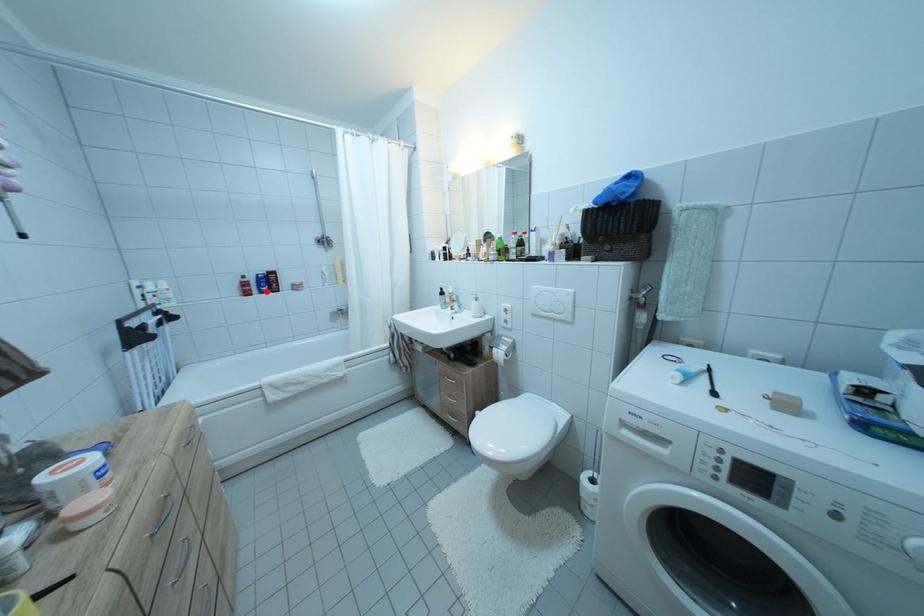
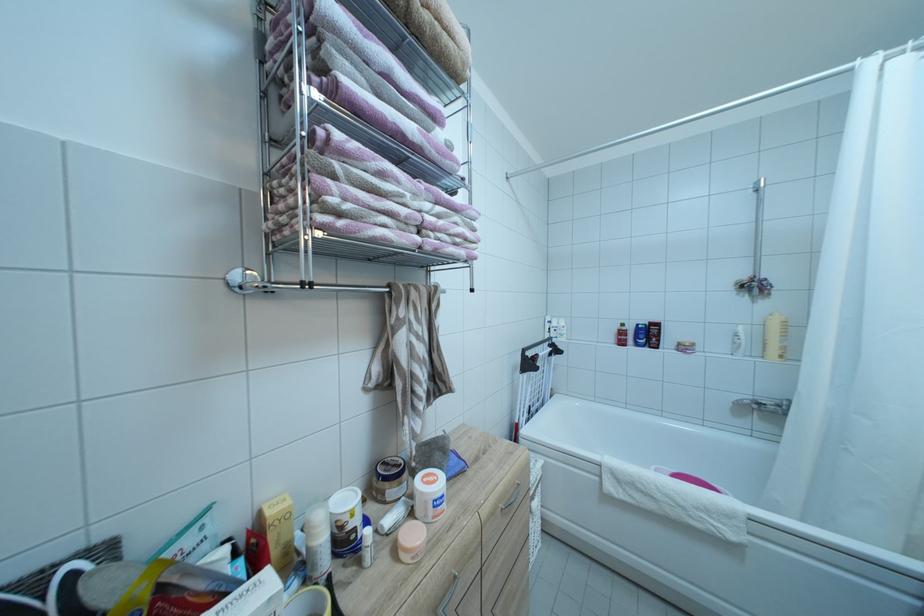
Find the pixel in the second image that matches the highlighted location in the first image.

(642, 342)